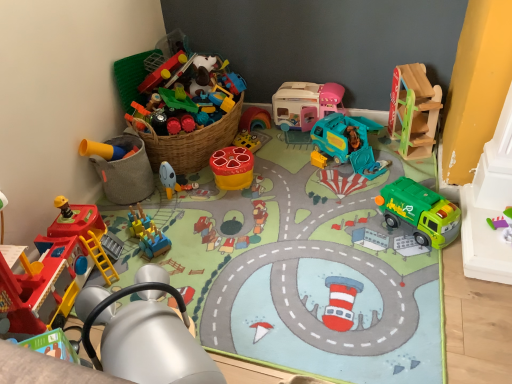
Where is `free space in front of wooden slide at upper right, marked as the 1th toy in a right-to-left arrangement`? This screenshot has height=384, width=512. free space in front of wooden slide at upper right, marked as the 1th toy in a right-to-left arrangement is located at coordinates (409, 167).